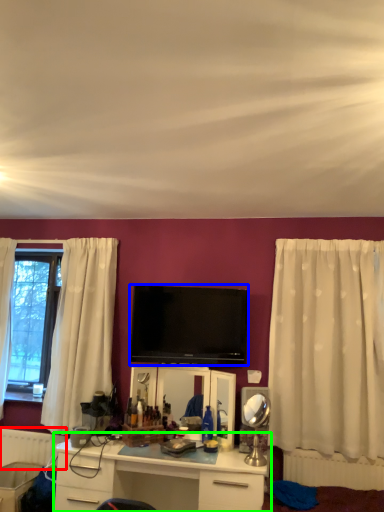
Question: Estimate the real-world distances between objects in this image. Which object is farther from radiator (highlighted by a red box), television (highlighted by a blue box) or desk (highlighted by a green box)?

Choices:
 (A) television
 (B) desk

Answer: (A)